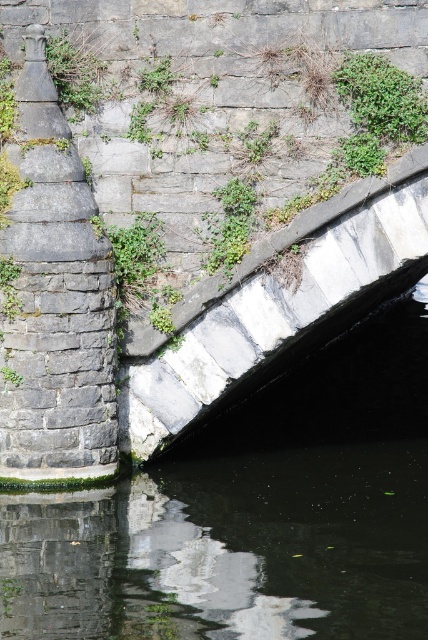
You are a small toy boat that is 1.5 meters long. You are floating on the black stone river at lower left and want to reach the stone bridge at center. Can you safely navigate to the bridge without hitting the sides?

The distance between the black stone river at lower left and the stone bridge at center is 1.85 meters. Since the toy boat is 1.5 meters long, it can safely navigate to the bridge as there is enough space between them.

You are standing at the coordinates point 0.5, 0.65. Is the stone bridge at center visible from your current position?

Yes, the stone bridge at center is located at point (x=278, y=314), which is very close to your position at (x=278, y=320). Therefore, it should be clearly visible from where you are standing.

You are standing on the stone bridge at center and want to look up at the green leafy plant at upper center. In which direction should you look?

The stone bridge at center is located below the green leafy plant at upper center, so you should look upward to see the green leafy plant at upper center.